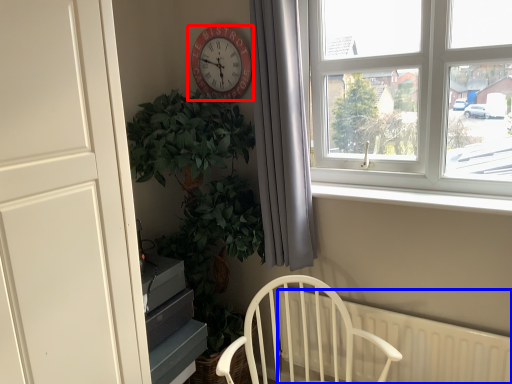
Question: Which object is further to the camera taking this photo, clock (highlighted by a red box) or radiator (highlighted by a blue box)?

Choices:
 (A) clock
 (B) radiator

Answer: (A)